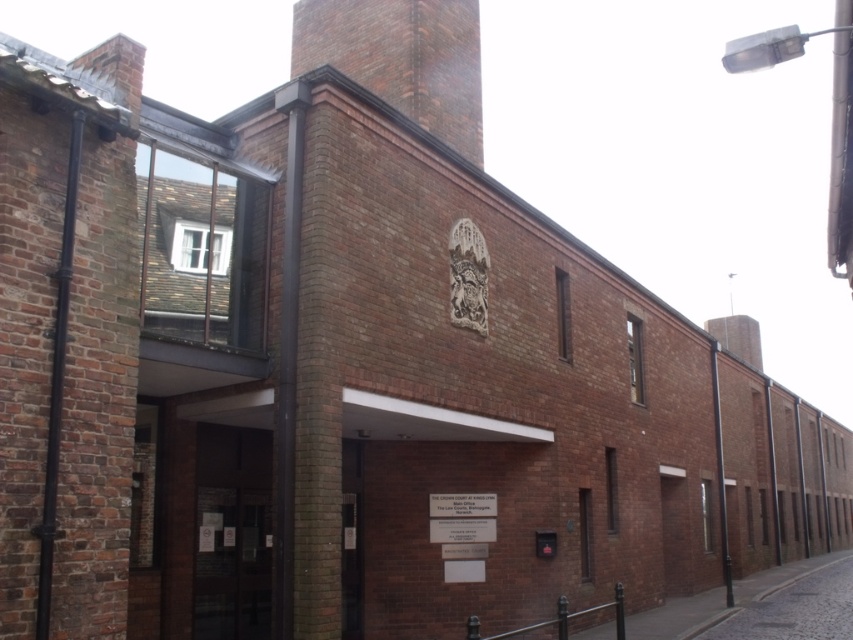
Is point (469, 122) closer to camera compared to point (776, 628)?

That is False.

Which of these two, brown brick chimney at upper center or cobblestone street at lower right, stands shorter?

brown brick chimney at upper center

Describe the element at coordinates (402, 58) in the screenshot. I see `brown brick chimney at upper center` at that location.

Where is `brown brick chimney at upper center`? This screenshot has width=853, height=640. brown brick chimney at upper center is located at coordinates (402, 58).

Between point (233, 616) and point (792, 584), which one is positioned in front?

Point (233, 616)

Does transparent glass door at center appear on the right side of cobblestone street at lower right?

Incorrect, transparent glass door at center is not on the right side of cobblestone street at lower right.

Is point (221, 442) positioned before point (733, 624)?

Yes, point (221, 442) is closer to viewer.

You are a GUI agent. You are given a task and a screenshot of the screen. Output one action in this format:
    pyautogui.click(x=<x>, y=<y>)
    Task: Click on the transparent glass door at center
    Image resolution: width=853 pixels, height=640 pixels.
    Given the screenshot: What is the action you would take?
    pyautogui.click(x=231, y=532)

Who is more forward, (335, 38) or (212, 449)?

Positioned in front is point (212, 449).

Does point (473, 52) come closer to viewer compared to point (228, 444)?

No, (473, 52) is further to viewer.

Is point (364, 22) closer to viewer compared to point (264, 436)?

No.

Find the location of a particular element. This screenshot has width=853, height=640. brown brick chimney at upper center is located at coordinates (402, 58).